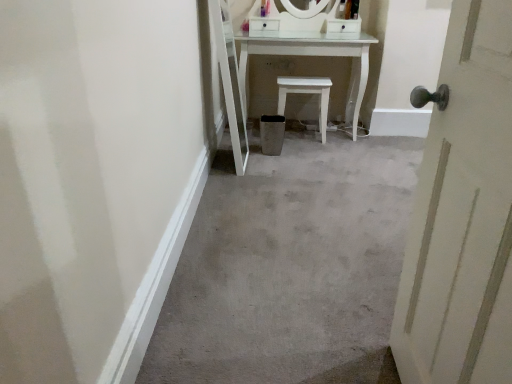
Question: From the image's perspective, does white matte stool at center appear lower than white painted wood door at right?

Choices:
 (A) no
 (B) yes

Answer: (A)

Question: From the image's perspective, does white matte stool at center appear higher than white painted wood door at right?

Choices:
 (A) no
 (B) yes

Answer: (B)

Question: Is white matte stool at center positioned far away from white painted wood door at right?

Choices:
 (A) yes
 (B) no

Answer: (A)

Question: Is white painted wood door at right completely or partially inside white matte stool at center?

Choices:
 (A) no
 (B) yes

Answer: (A)

Question: Considering the relative sizes of white matte stool at center and white painted wood door at right in the image provided, is white matte stool at center bigger than white painted wood door at right?

Choices:
 (A) no
 (B) yes

Answer: (A)

Question: Considering the relative sizes of white matte stool at center and white painted wood door at right in the image provided, is white matte stool at center smaller than white painted wood door at right?

Choices:
 (A) yes
 (B) no

Answer: (A)

Question: Is white painted wood door at right oriented towards white matte stool at center?

Choices:
 (A) yes
 (B) no

Answer: (B)

Question: From the image's perspective, is white painted wood door at right under white matte stool at center?

Choices:
 (A) no
 (B) yes

Answer: (B)

Question: Does white painted wood door at right appear on the left side of white matte stool at center?

Choices:
 (A) no
 (B) yes

Answer: (A)

Question: Does white painted wood door at right appear on the right side of white matte stool at center?

Choices:
 (A) yes
 (B) no

Answer: (A)

Question: From a real-world perspective, is white painted wood door at right over white matte stool at center?

Choices:
 (A) no
 (B) yes

Answer: (B)

Question: Can you confirm if white painted wood door at right is smaller than white matte stool at center?

Choices:
 (A) no
 (B) yes

Answer: (A)

Question: In terms of width, does white painted wood door at right look wider or thinner when compared to white matte stool at center?

Choices:
 (A) thin
 (B) wide

Answer: (A)